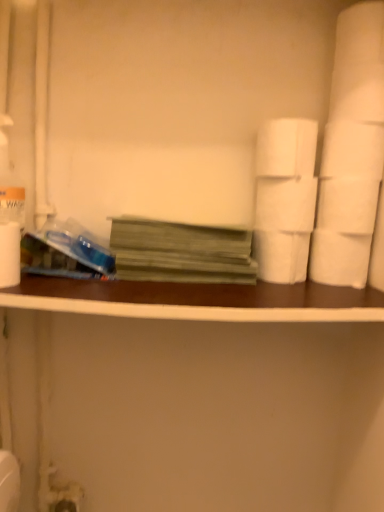
Question: Should I look upward or downward to see white matte paper towel at left?

Choices:
 (A) up
 (B) down

Answer: (A)

Question: Can you confirm if white matte paper towel at left is smaller than white matte toilet paper at center right, the fourth toilet paper ordered from the bottom?

Choices:
 (A) yes
 (B) no

Answer: (A)

Question: From a real-world perspective, is white matte paper towel at left over white matte toilet paper at center right, the second toilet paper when ordered from top to bottom?

Choices:
 (A) yes
 (B) no

Answer: (B)

Question: Is white matte paper towel at left shorter than white matte toilet paper at center right, the fourth toilet paper ordered from the bottom?

Choices:
 (A) no
 (B) yes

Answer: (A)

Question: From the image's perspective, is white matte paper towel at left located beneath white matte toilet paper at center right, the second toilet paper when ordered from top to bottom?

Choices:
 (A) yes
 (B) no

Answer: (A)

Question: Considering the relative sizes of white matte paper towel at left and white matte toilet paper at center right, the fourth toilet paper ordered from the bottom, in the image provided, is white matte paper towel at left wider than white matte toilet paper at center right, the fourth toilet paper ordered from the bottom,?

Choices:
 (A) no
 (B) yes

Answer: (A)

Question: Considering the relative sizes of white matte paper towel at left and white matte toilet paper at center right, the fourth toilet paper ordered from the bottom, in the image provided, is white matte paper towel at left taller than white matte toilet paper at center right, the fourth toilet paper ordered from the bottom,?

Choices:
 (A) yes
 (B) no

Answer: (A)

Question: Is brown wood ledge at center wider than white matte toilet paper at right, arranged as the first toilet paper when ordered from the bottom?

Choices:
 (A) yes
 (B) no

Answer: (A)

Question: Can you confirm if brown wood ledge at center is bigger than white matte toilet paper at right, arranged as the first toilet paper when ordered from the bottom?

Choices:
 (A) no
 (B) yes

Answer: (B)

Question: From the image's perspective, would you say brown wood ledge at center is positioned over white matte toilet paper at right, arranged as the first toilet paper when ordered from the bottom?

Choices:
 (A) no
 (B) yes

Answer: (A)

Question: Is brown wood ledge at center looking in the opposite direction of white matte toilet paper at right, arranged as the first toilet paper when ordered from the bottom?

Choices:
 (A) yes
 (B) no

Answer: (B)

Question: Is brown wood ledge at center shorter than white matte toilet paper at right, the 5th toilet paper when ordered from top to bottom?

Choices:
 (A) no
 (B) yes

Answer: (B)

Question: Would you say brown wood ledge at center is a long distance from white matte toilet paper at right, the 5th toilet paper when ordered from top to bottom?

Choices:
 (A) no
 (B) yes

Answer: (A)

Question: Can you confirm if green matte book at center is shorter than white matte toilet paper at center right, the fourth toilet paper ordered from the bottom?

Choices:
 (A) yes
 (B) no

Answer: (B)